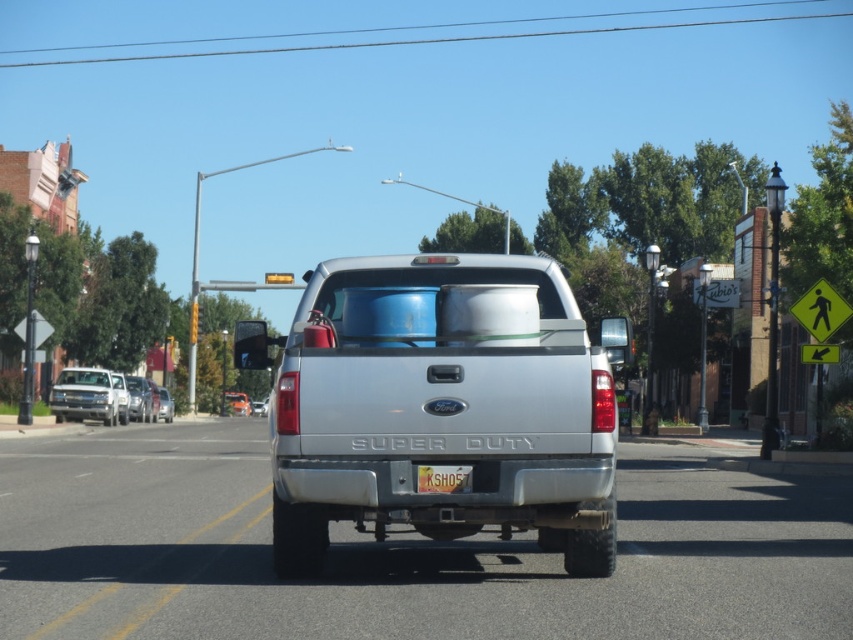
You are a delivery driver who needs to park your vehicle in a spot that can only accommodate vehicles up to the height of the satin silver sedan at center. You have a silver metallic truck at center. Can your truck fit in that parking spot?

The silver metallic truck at center is taller than the satin silver sedan at center. Therefore, the truck cannot fit in the parking spot designed for vehicles up to the sedan height.

You are standing at the origin point in the image. The silver metallic truck at center is located at point (440, 404). Can you determine the direction of the silver metallic truck at center relative to your position?

The silver metallic truck at center is located at point (440, 404), which is to the right and slightly above your current position at the origin.

You are a pedestrian standing on the sidewalk and see the silver metallic truck at center and the satin silver sedan at center parked on the street. Which vehicle is blocking the other one?

The silver metallic truck at center is positioned over the satin silver sedan at center, meaning it is blocking the sedan.